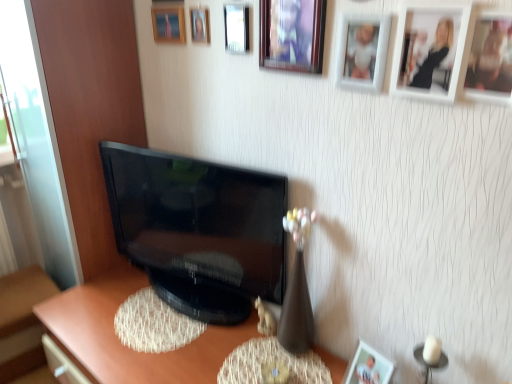
What are the coordinates of `free space that is to the left of white plastic dog at lower center` in the screenshot? It's located at (228, 339).